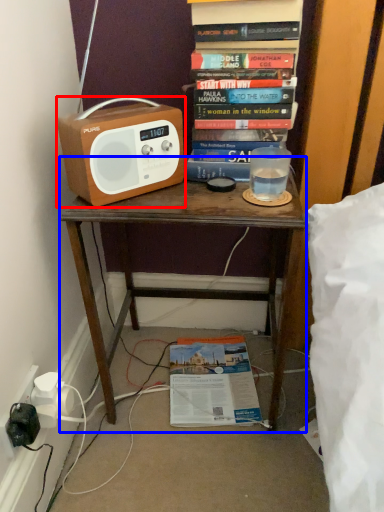
Question: Which object appears closest to the camera in this image, cassette (highlighted by a red box) or desk (highlighted by a blue box)?

Choices:
 (A) cassette
 (B) desk

Answer: (A)